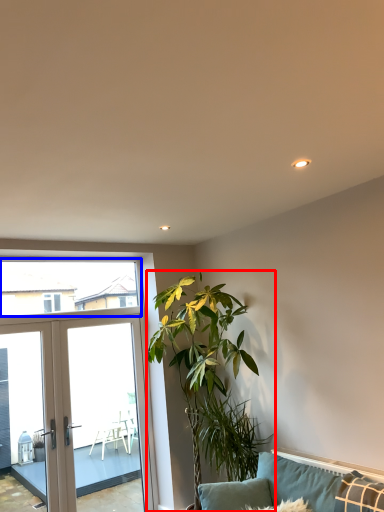
Question: Among these objects, which one is nearest to the camera, houseplant (highlighted by a red box) or window screen (highlighted by a blue box)?

Choices:
 (A) houseplant
 (B) window screen

Answer: (A)